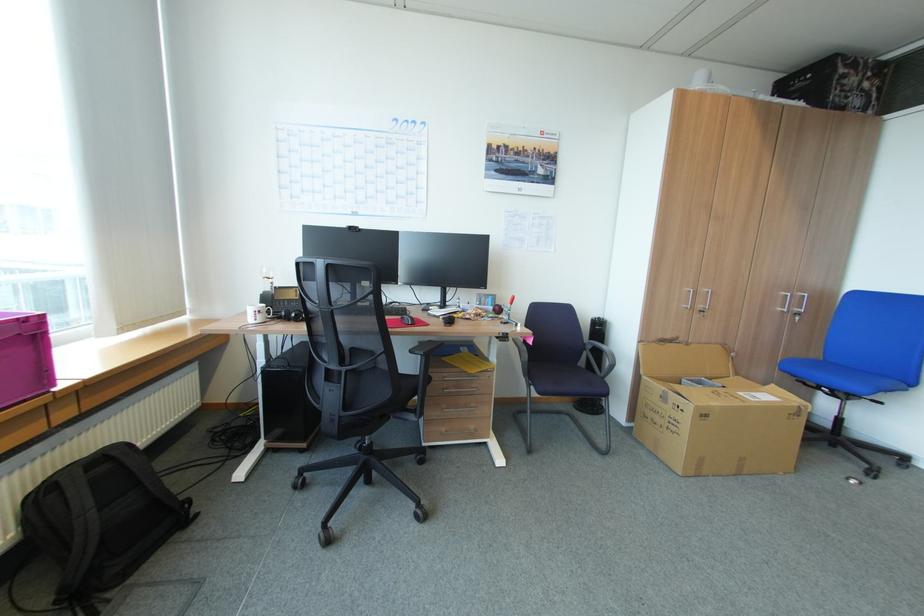
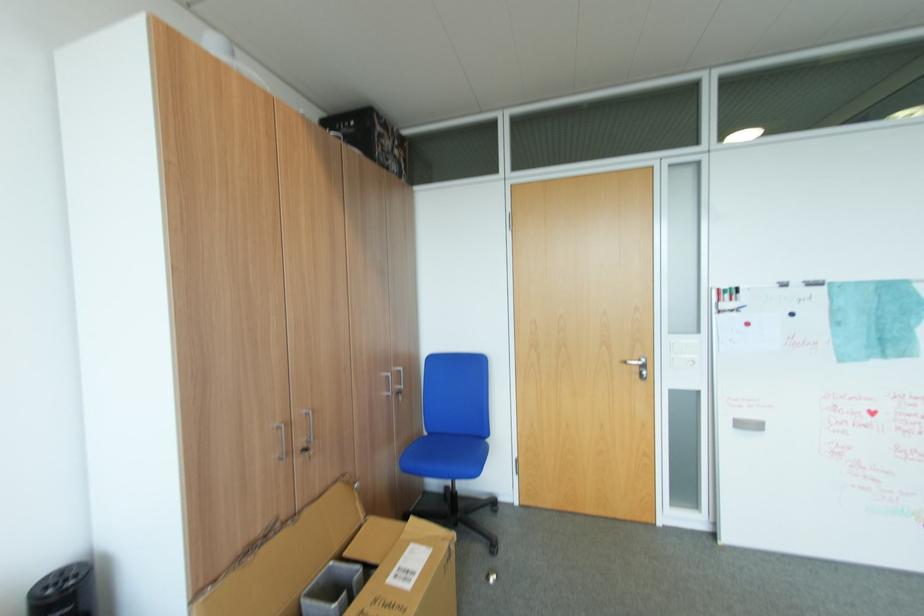
Find the pixel in the second image that matches pixel 801 405 in the first image.

(451, 544)